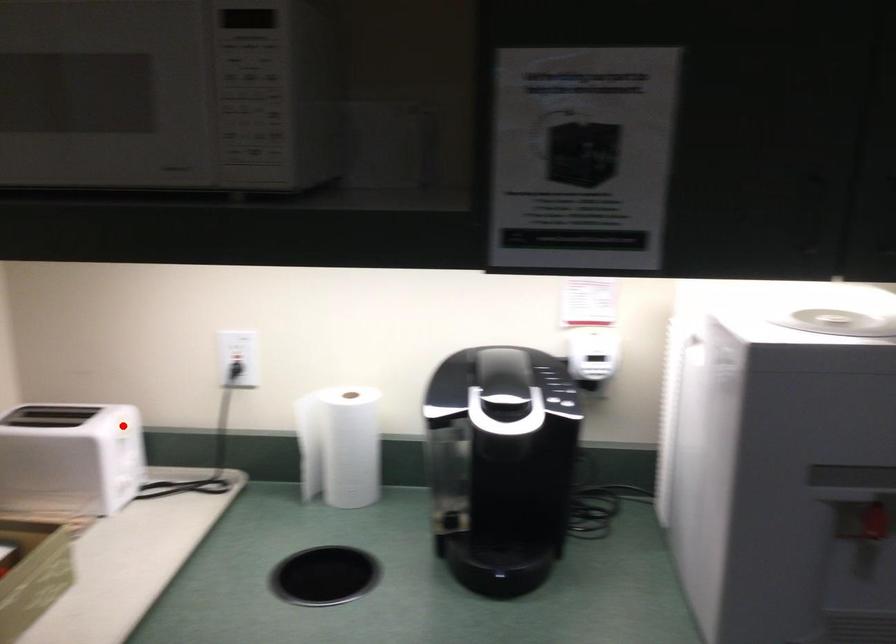
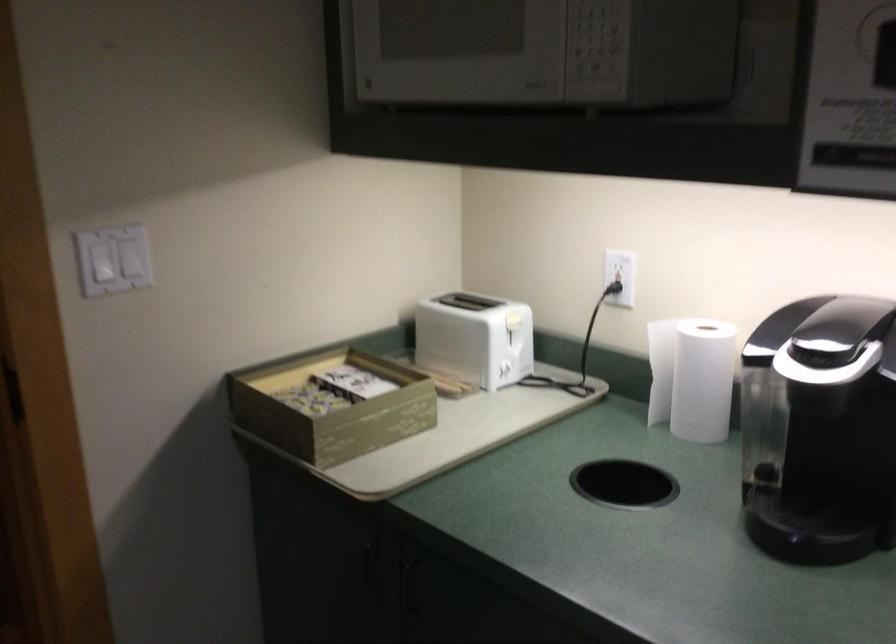
In the second image, find the point that corresponds to the highlighted location in the first image.

(511, 317)